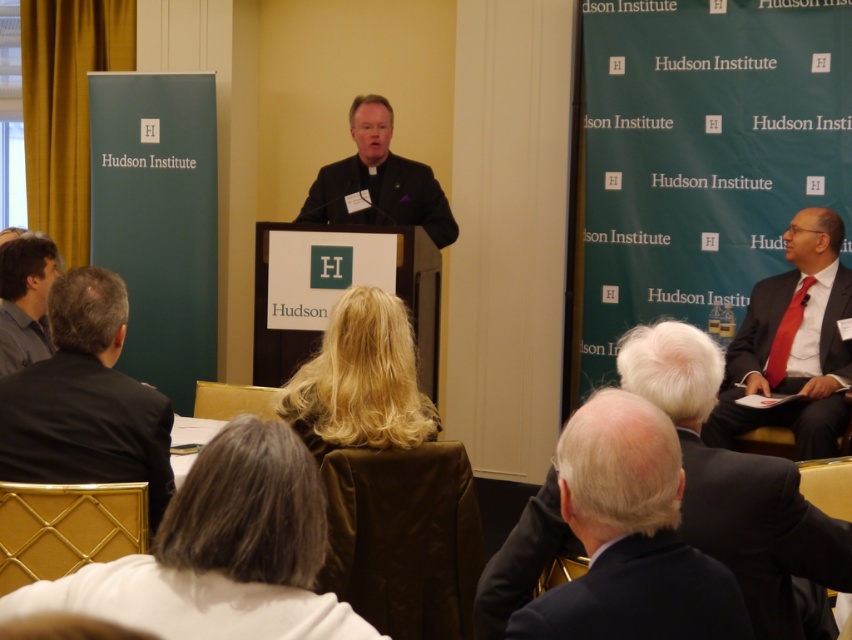
Does dark gray suit at lower right appear on the right side of matte gray shirt at left?

Indeed, dark gray suit at lower right is positioned on the right side of matte gray shirt at left.

You are a GUI agent. You are given a task and a screenshot of the screen. Output one action in this format:
    pyautogui.click(x=<x>, y=<y>)
    Task: Click on the dark gray suit at lower right
    The image size is (852, 640).
    Given the screenshot: What is the action you would take?
    pyautogui.click(x=629, y=536)

Between white fabric at lower left and blonde hair at center, which one appears on the right side from the viewer's perspective?

blonde hair at center

Does white fabric at lower left appear under blonde hair at center?

Yes, white fabric at lower left is below blonde hair at center.

Who is more forward, (237, 544) or (390, 445)?

Point (237, 544) is more forward.

This screenshot has height=640, width=852. In order to click on white fabric at lower left in this screenshot , I will do `click(220, 552)`.

Does white fabric at lower left come in front of matte gray shirt at left?

Yes, white fabric at lower left is in front of matte gray shirt at left.

The image size is (852, 640). Describe the element at coordinates (220, 552) in the screenshot. I see `white fabric at lower left` at that location.

Which is behind, point (325, 525) or point (10, 280)?

The point (10, 280) is behind.

Identify the location of white fabric at lower left. The width and height of the screenshot is (852, 640). (220, 552).